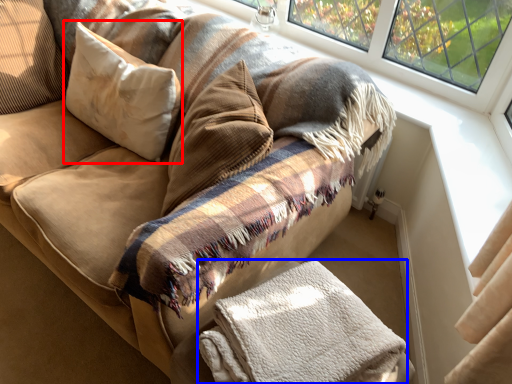
Question: Among these objects, which one is farthest to the camera, pillow (highlighted by a red box) or material (highlighted by a blue box)?

Choices:
 (A) pillow
 (B) material

Answer: (A)